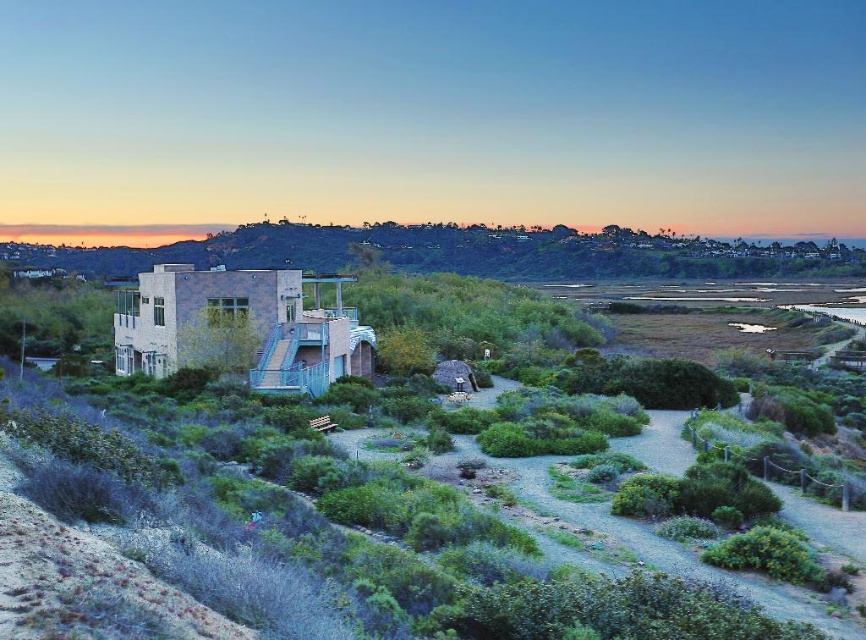
You are planning to set up a small tent in the image. The tent requires a base that is wider than the green leafy shrubs at center. Can the green grassy hillside at center provide enough space for the tent? Please explain.

The green leafy shrubs at center is thinner than the green grassy hillside at center. Since the grassy hillside is wider, it can provide enough space for the tent as long as the required width is met.